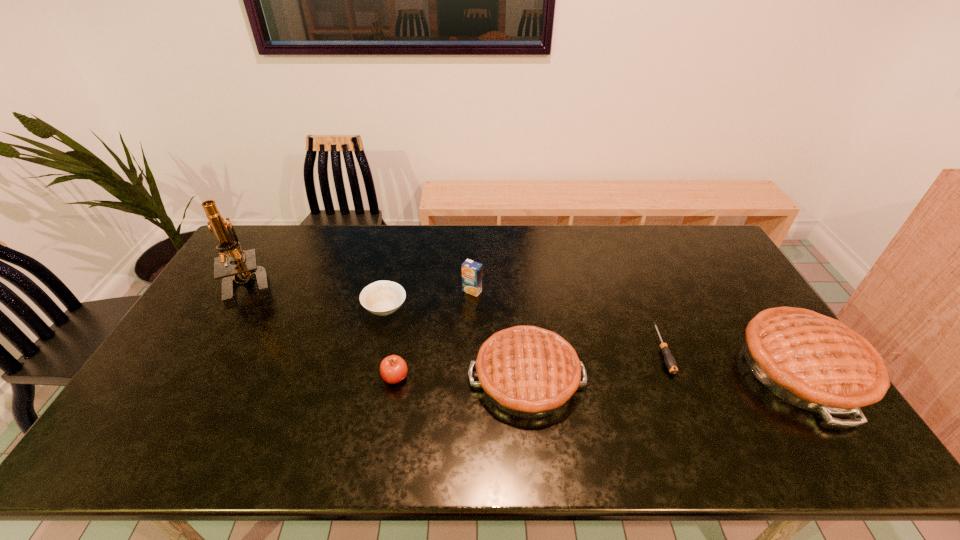
What are the coordinates of `blank area located 0.340m on the back of the left pie` in the screenshot? It's located at (516, 266).

In order to click on vacant space located on the left of the sixth shortest object in this screenshot , I will do `click(703, 369)`.

This screenshot has width=960, height=540. I want to click on blank space located on the left of the orange_juice, so click(428, 291).

Locate an element on the screen. The width and height of the screenshot is (960, 540). vacant space located on the left of the screwdriver is located at coordinates (541, 350).

I want to click on free region located 0.350m at the eyepiece of the leftmost object, so click(180, 401).

Identify the location of free space located 0.160m on the left of the sixth tallest object. (312, 308).

Image resolution: width=960 pixels, height=540 pixels. What are the coordinates of `vacant space located 0.380m on the back of the apple` in the screenshot? It's located at (413, 276).

Find the location of a particular element. This screenshot has height=540, width=960. object that is positioned at the far edge is located at coordinates (245, 267).

Identify the location of object that is at the left edge. (245, 267).

I want to click on object that is at the right edge, so click(814, 362).